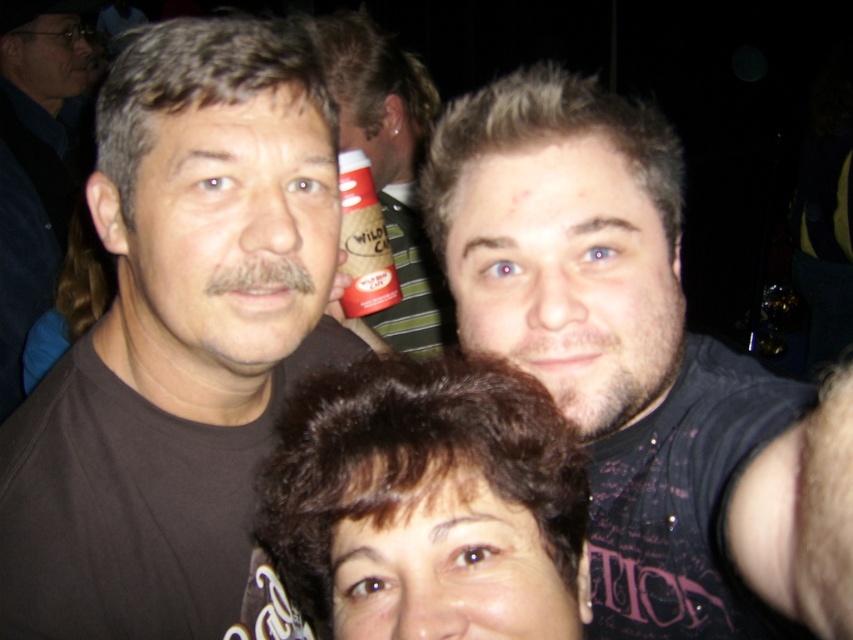
Question: Is dark brown curly hair at center positioned behind brown shirt at left?

Choices:
 (A) no
 (B) yes

Answer: (A)

Question: Where is dark brown curly hair at center located in relation to brown shirt at left in the image?

Choices:
 (A) above
 (B) below

Answer: (B)

Question: Among these points, which one is nearest to the camera?

Choices:
 (A) (39, 68)
 (B) (796, 636)

Answer: (B)

Question: Which point is farther from the camera taking this photo?

Choices:
 (A) (386, 266)
 (B) (392, 321)
 (C) (590, 474)
 (D) (15, 147)

Answer: (D)

Question: Which point is farther to the camera?

Choices:
 (A) red plastic cup at center
 (B) brown matte shirt at upper left
 (C) matte plastic can at center

Answer: (A)

Question: From the image, what is the correct spatial relationship of brown shirt at left in relation to red plastic cup at center?

Choices:
 (A) left
 (B) right

Answer: (A)